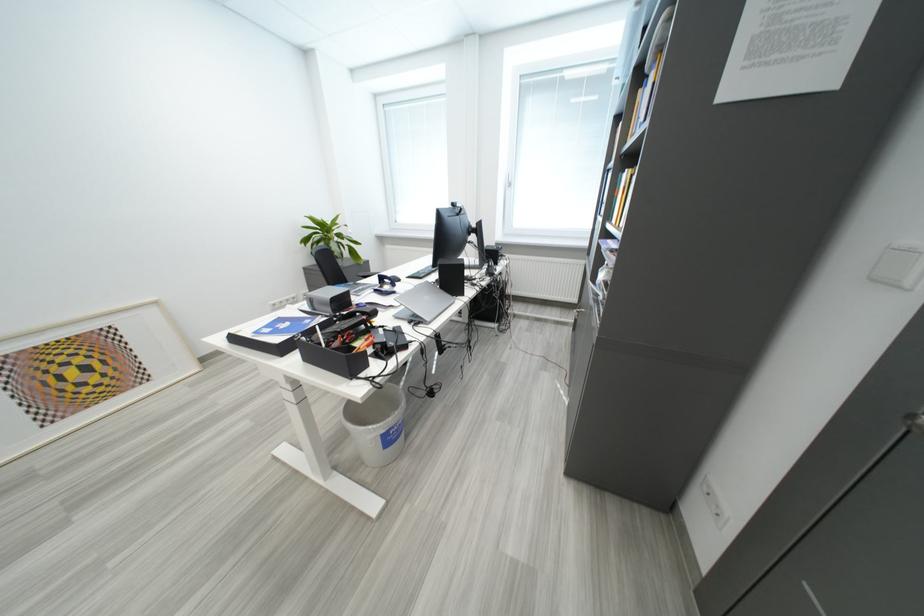
The width and height of the screenshot is (924, 616). What are the coordinates of `silver door handle` in the screenshot? It's located at (912, 422).